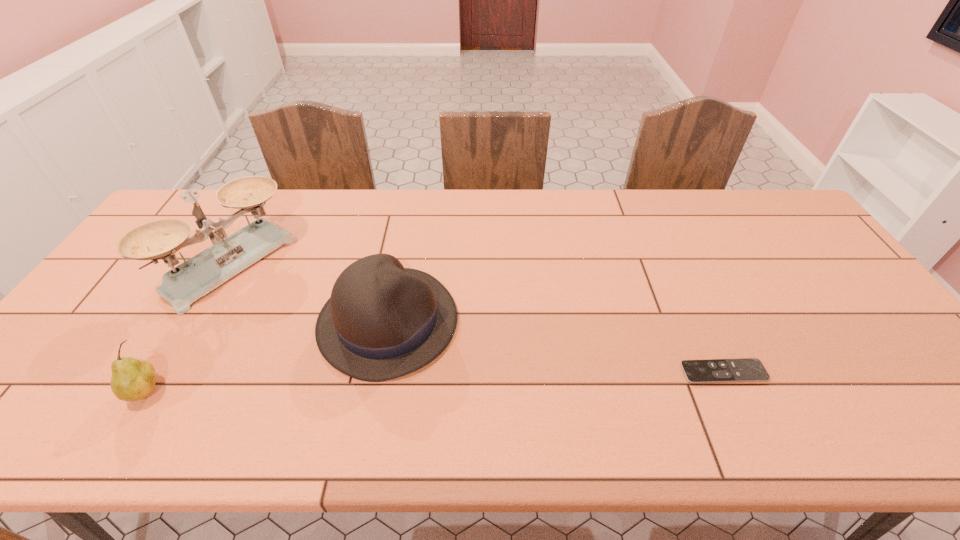
The height and width of the screenshot is (540, 960). I want to click on free space located 0.230m on the front-facing side of the scale, so click(x=319, y=331).

Identify the location of vacant space located on the front-facing side of the second tallest object. This screenshot has height=540, width=960. (469, 358).

Where is `vacant space located on the front-facing side of the second tallest object`? The image size is (960, 540). vacant space located on the front-facing side of the second tallest object is located at coordinates (506, 374).

The width and height of the screenshot is (960, 540). I want to click on vacant space located on the front-facing side of the second tallest object, so click(514, 378).

The width and height of the screenshot is (960, 540). I want to click on object present at the far edge, so click(181, 286).

You are a GUI agent. You are given a task and a screenshot of the screen. Output one action in this format:
    pyautogui.click(x=<x>, y=<y>)
    Task: Click on the pear at the near edge
    The width and height of the screenshot is (960, 540).
    Given the screenshot: What is the action you would take?
    pyautogui.click(x=132, y=379)

Where is `remote control that is at the near edge`? Image resolution: width=960 pixels, height=540 pixels. remote control that is at the near edge is located at coordinates [749, 369].

Locate an element on the screen. bowler hat present at the near edge is located at coordinates (x=383, y=321).

At what (x,y) coordinates should I click in order to perform the action: click on object located in the left edge section of the desktop. Please return your answer as a coordinate pair (x, y). Looking at the image, I should click on (181, 286).

Where is `object located at the far left corner`? This screenshot has width=960, height=540. object located at the far left corner is located at coordinates (181, 286).